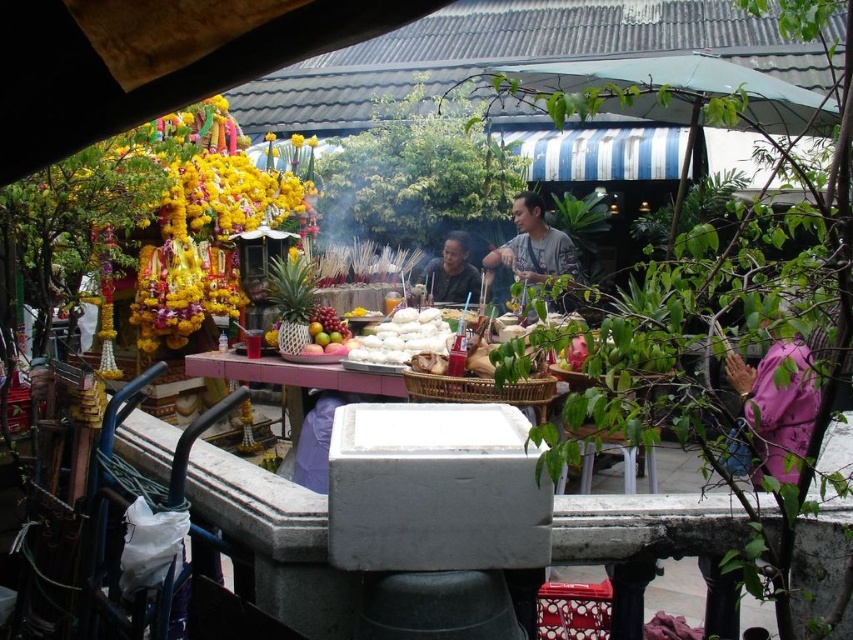
You are a photographer taking a picture of the altar. You notice the pink fabric at right and the gray cotton shirt at center in your frame. Based on their heights, which one should you adjust your camera angle to focus on first?

The pink fabric at right is not as tall as the gray cotton shirt at center, so you should adjust your camera angle to focus on the gray cotton shirt at center first since it is taller.

You are a food vendor at the market and need to place a 1.5 meter long banner between the gray cotton shirt at center and the white fluffy dumplings at center. Can you fit it there?

The distance between the gray cotton shirt at center and the white fluffy dumplings at center is 1.38 meters. Since the banner is 1.5 meters long, it is longer than the available space, so it won

You are a photographer standing in the market and want to capture both the gray cotton shirt at center and the white fluffy dumplings at center in a single photo. Since you want the shirt to be visible, should you focus on the upper or lower part of the frame?

You should focus on the upper part of the frame because the gray cotton shirt at center is located above the white fluffy dumplings at center.